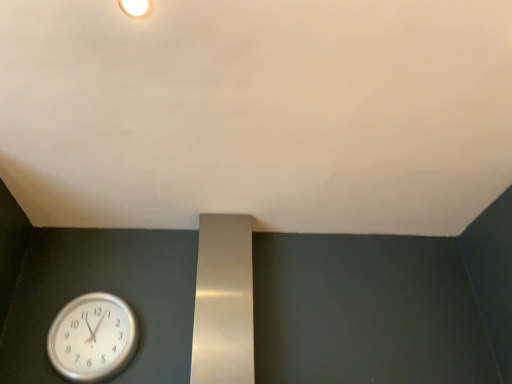
Question: Does white matte light fixture at upper center lie behind silver metallic clock at lower left?

Choices:
 (A) no
 (B) yes

Answer: (A)

Question: Does white matte light fixture at upper center appear on the left side of silver metallic clock at lower left?

Choices:
 (A) no
 (B) yes

Answer: (A)

Question: Does white matte light fixture at upper center have a lesser width compared to silver metallic clock at lower left?

Choices:
 (A) no
 (B) yes

Answer: (B)

Question: From a real-world perspective, is white matte light fixture at upper center below silver metallic clock at lower left?

Choices:
 (A) no
 (B) yes

Answer: (A)

Question: Are white matte light fixture at upper center and silver metallic clock at lower left making contact?

Choices:
 (A) yes
 (B) no

Answer: (B)

Question: Considering the positions of point (126, 334) and point (205, 130), is point (126, 334) closer or farther from the camera than point (205, 130)?

Choices:
 (A) closer
 (B) farther

Answer: (B)

Question: Relative to white matte wall at upper center, is silver metallic clock at lower left in front or behind?

Choices:
 (A) front
 (B) behind

Answer: (B)

Question: Choose the correct answer: Is silver metallic clock at lower left inside white matte wall at upper center or outside it?

Choices:
 (A) outside
 (B) inside

Answer: (A)

Question: Based on their positions, is silver metallic clock at lower left located to the left or right of white matte wall at upper center?

Choices:
 (A) right
 (B) left

Answer: (B)

Question: In terms of size, does silver metallic clock at lower left appear bigger or smaller than white matte light fixture at upper center?

Choices:
 (A) big
 (B) small

Answer: (A)

Question: Considering the positions of silver metallic clock at lower left and white matte light fixture at upper center in the image, is silver metallic clock at lower left taller or shorter than white matte light fixture at upper center?

Choices:
 (A) short
 (B) tall

Answer: (B)

Question: Looking at their shapes, would you say silver metallic clock at lower left is wider or thinner than white matte light fixture at upper center?

Choices:
 (A) thin
 (B) wide

Answer: (B)

Question: From a real-world perspective, is silver metallic clock at lower left above or below white matte light fixture at upper center?

Choices:
 (A) above
 (B) below

Answer: (B)

Question: Considering the positions of white matte light fixture at upper center and silver metallic clock at lower left in the image, is white matte light fixture at upper center taller or shorter than silver metallic clock at lower left?

Choices:
 (A) short
 (B) tall

Answer: (A)

Question: Relative to silver metallic clock at lower left, is white matte light fixture at upper center in front or behind?

Choices:
 (A) behind
 (B) front

Answer: (B)